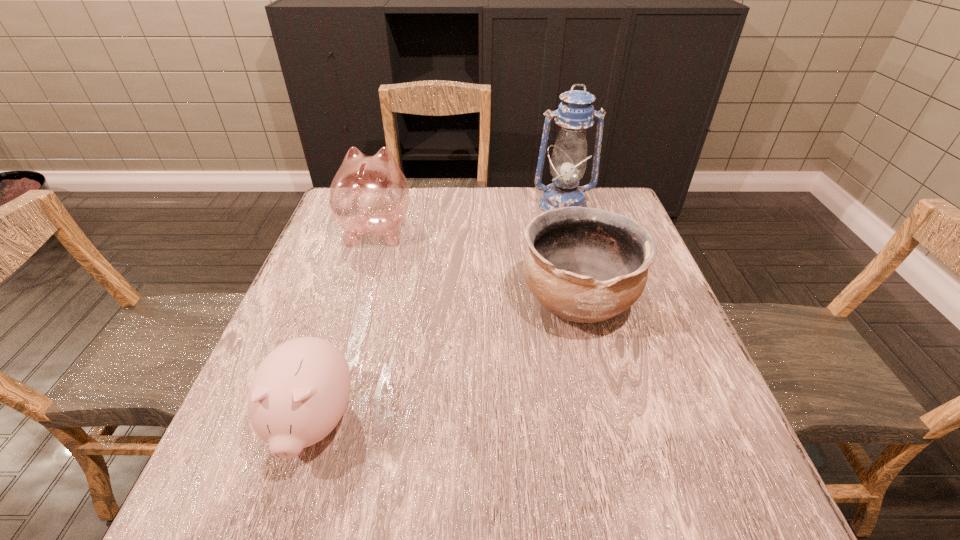
This screenshot has width=960, height=540. Find the location of `free space located on the left of the third farthest object`. free space located on the left of the third farthest object is located at coordinates (450, 301).

You are a GUI agent. You are given a task and a screenshot of the screen. Output one action in this format:
    pyautogui.click(x=<x>, y=<y>)
    Task: Click on the lantern that is at the far edge
    The image size is (960, 540).
    Given the screenshot: What is the action you would take?
    pyautogui.click(x=575, y=113)

Image resolution: width=960 pixels, height=540 pixels. What are the coordinates of `piggy bank located at the far edge` in the screenshot? It's located at (369, 196).

This screenshot has width=960, height=540. I want to click on object located at the near edge, so click(298, 394).

You are a GUI agent. You are given a task and a screenshot of the screen. Output one action in this format:
    pyautogui.click(x=<x>, y=<y>)
    Task: Click on the lantern located in the right edge section of the desktop
    The height and width of the screenshot is (540, 960).
    Given the screenshot: What is the action you would take?
    [575, 113]

The height and width of the screenshot is (540, 960). In order to click on pottery located at the right edge in this screenshot , I will do `click(587, 265)`.

Where is `object that is positioned at the far left corner`? This screenshot has width=960, height=540. object that is positioned at the far left corner is located at coordinates (369, 196).

Find the location of a particular element. The width and height of the screenshot is (960, 540). object that is positioned at the near left corner is located at coordinates (298, 394).

You are a GUI agent. You are given a task and a screenshot of the screen. Output one action in this format:
    pyautogui.click(x=<x>, y=<y>)
    Task: Click on the object present at the far right corner
    
    Given the screenshot: What is the action you would take?
    click(575, 113)

Identify the location of vacant space at the far edge of the desktop. (525, 227).